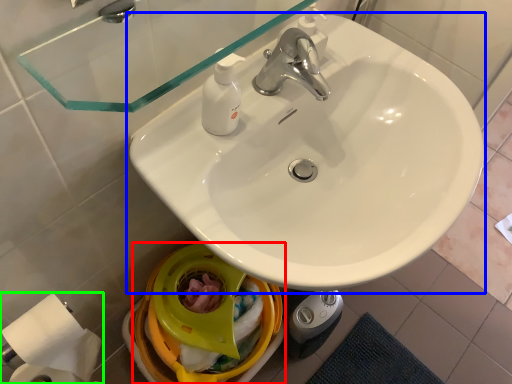
Question: Which object is positioned closest to bidet (highlighted by a red box)? Select from sink (highlighted by a blue box) and toilet paper (highlighted by a green box).

Choices:
 (A) sink
 (B) toilet paper

Answer: (B)